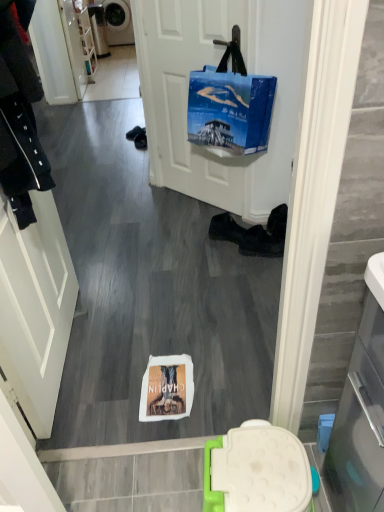
Identify the location of empty space that is in between white glossy door at left and black leather boots at lower center, the second footwear positioned from the left. (154, 304).